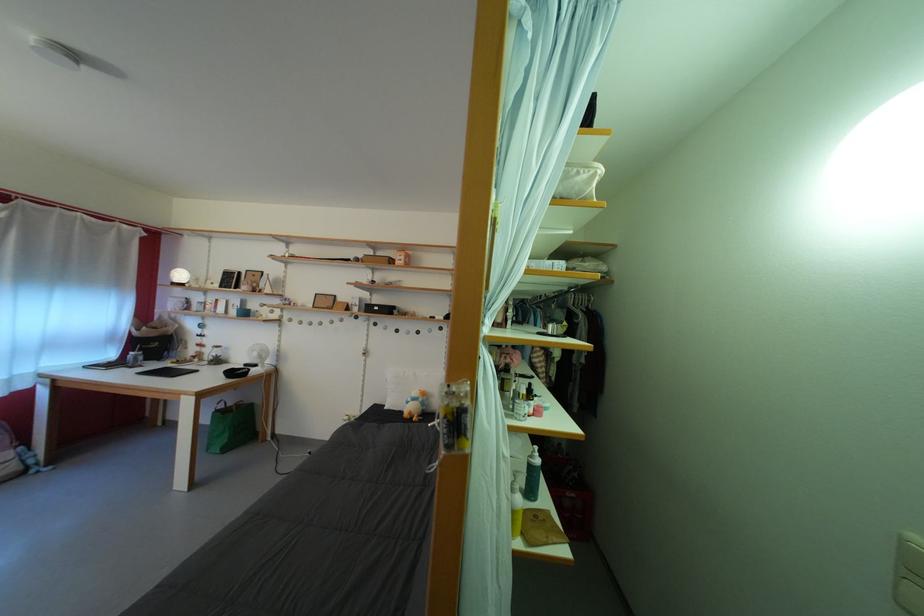
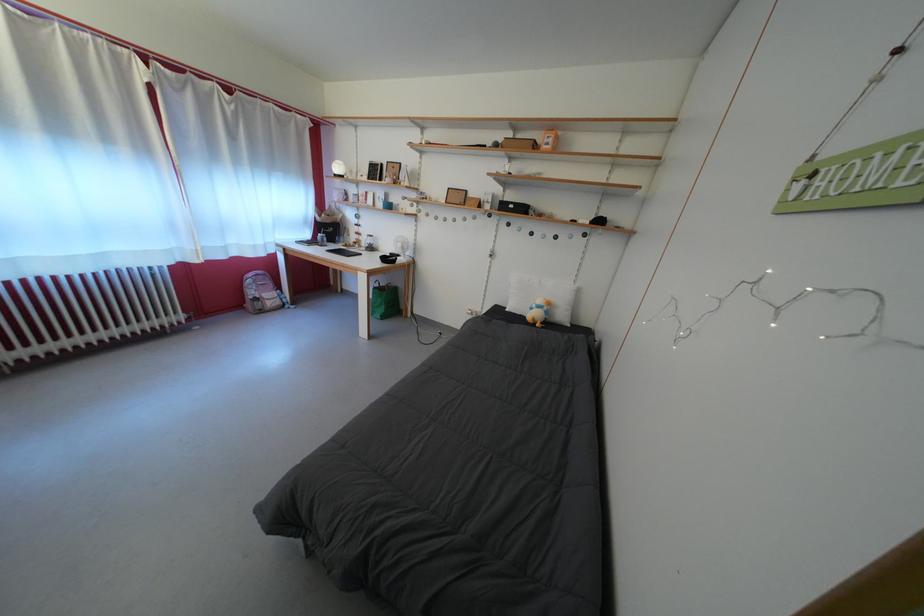
Find the pixel in the second image that matches point 247,369 in the first image.

(394, 257)